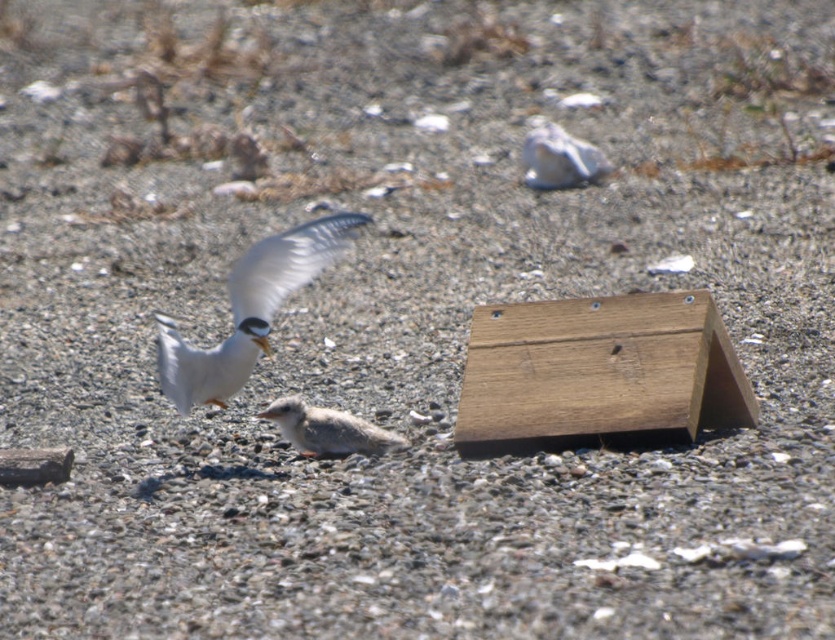
Question: Can you confirm if brown wooden box at center is bigger than gray downy chick at center?

Choices:
 (A) yes
 (B) no

Answer: (A)

Question: Is brown wooden box at center to the right of white feathered bird at center from the viewer's perspective?

Choices:
 (A) no
 (B) yes

Answer: (B)

Question: Which of these objects is positioned farthest from the brown wooden box at center?

Choices:
 (A) gray downy chick at center
 (B) white matte rock at upper center

Answer: (B)

Question: Does brown wooden box at center have a greater width compared to white matte rock at upper center?

Choices:
 (A) yes
 (B) no

Answer: (A)

Question: Which object appears closest to the camera in this image?

Choices:
 (A) white matte rock at upper center
 (B) brown wooden box at center

Answer: (B)

Question: Among these points, which one is farthest from the camera?

Choices:
 (A) (312, 456)
 (B) (552, 140)
 (C) (208, 403)

Answer: (B)